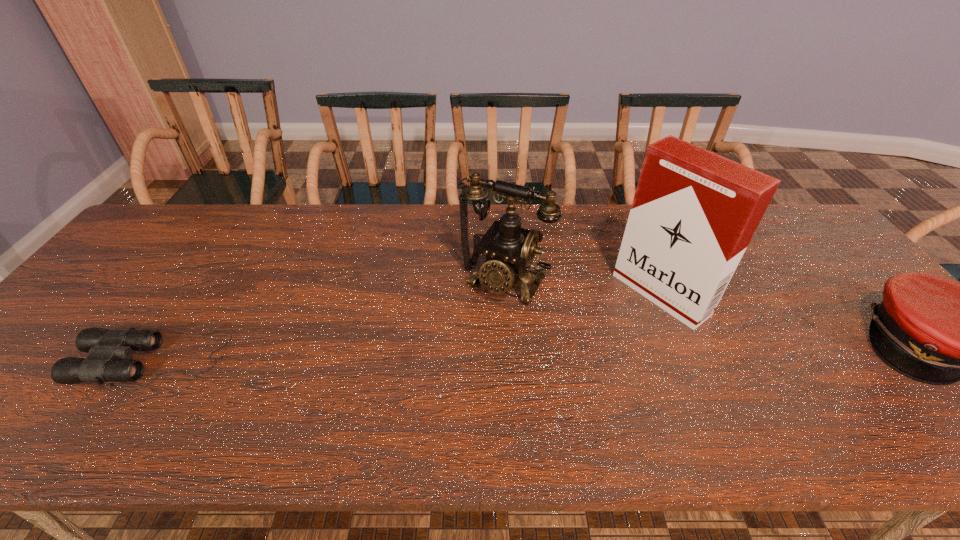
The image size is (960, 540). Identify the location of free space on the desktop that is between the leftmost object and the rightmost object and is positioned on the front-facing side of the third object from left to right. (584, 349).

Where is `free space on the desktop that is between the leftmost object and the third tallest object and is positioned on the rotary dial of the telephone`? This screenshot has height=540, width=960. free space on the desktop that is between the leftmost object and the third tallest object and is positioned on the rotary dial of the telephone is located at coordinates (458, 352).